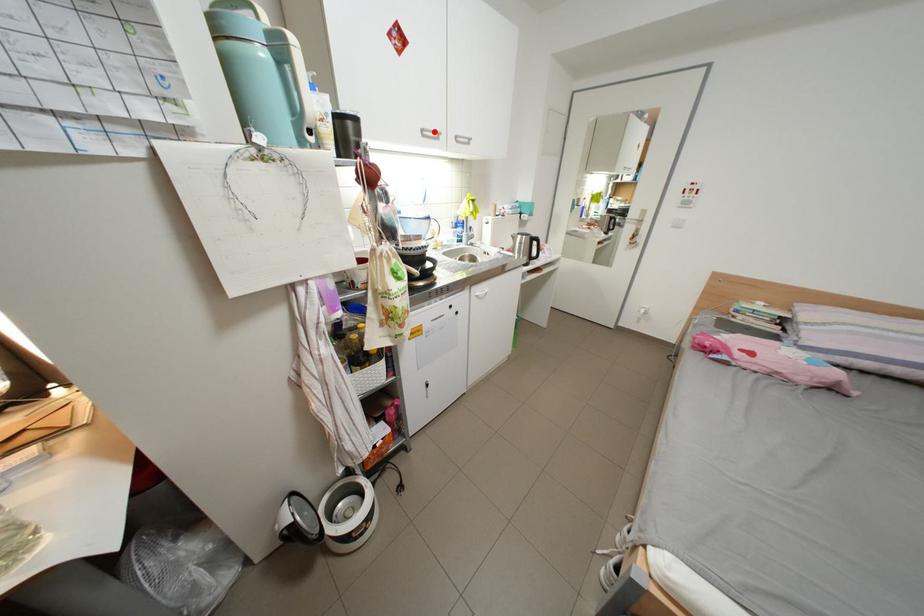
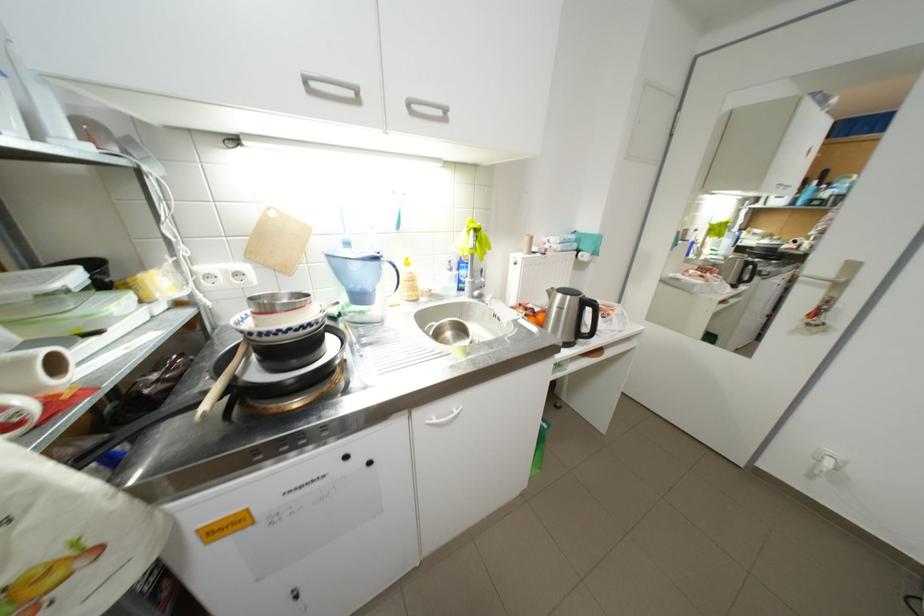
The point at the highlighted location is marked in the first image. Where is the corresponding point in the second image?

(317, 79)